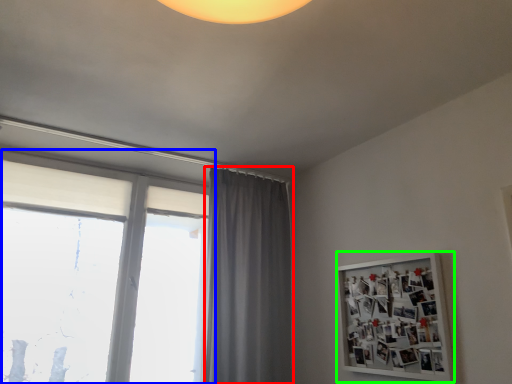
Question: Estimate the real-world distances between objects in this image. Which object is closer to curtain (highlighted by a red box), window (highlighted by a blue box) or bulletin board (highlighted by a green box)?

Choices:
 (A) window
 (B) bulletin board

Answer: (A)